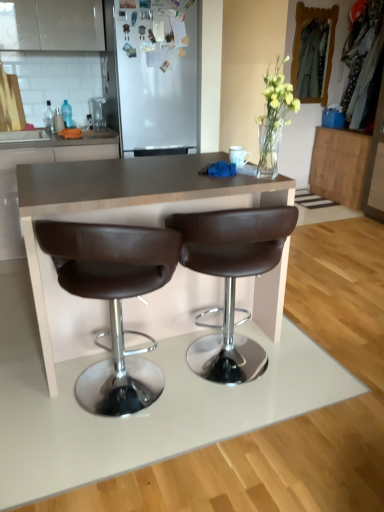
The width and height of the screenshot is (384, 512). I want to click on blank space situated above brown leather stool at center, arranged as the 1th chair when viewed from the right (from a real-world perspective), so click(x=235, y=186).